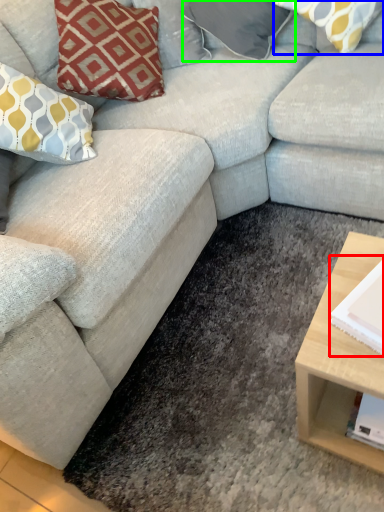
Question: Considering the real-world distances, which object is closest to magazine (highlighted by a red box)? pillow (highlighted by a blue box) or pillow (highlighted by a green box).

Choices:
 (A) pillow
 (B) pillow

Answer: (A)